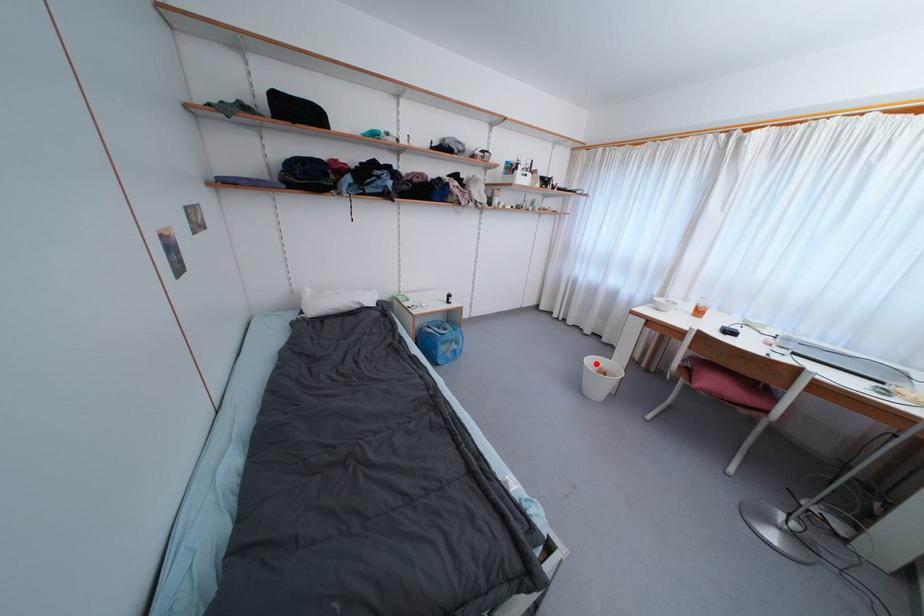
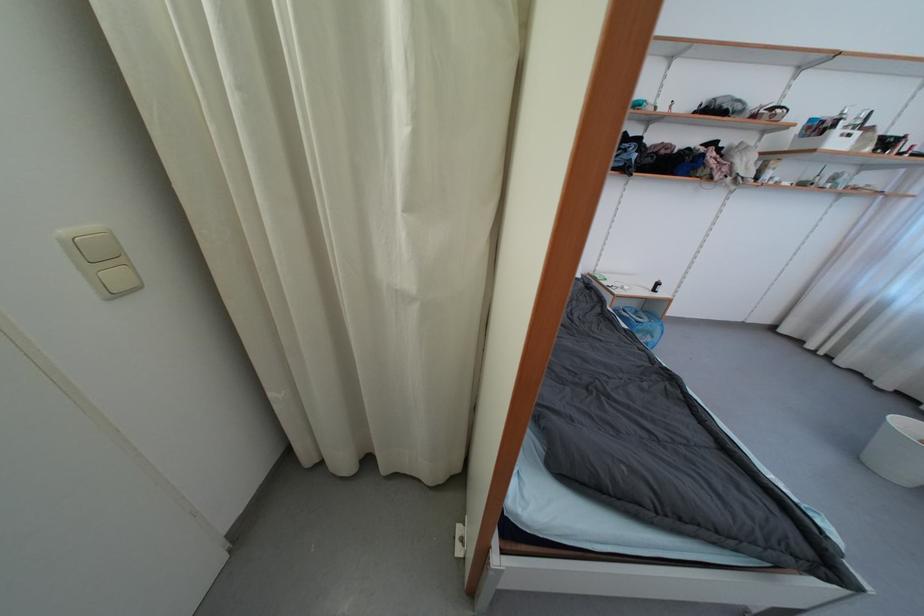
Where in the second image is the point corresponding to the highlighted location from the first image?

(912, 428)